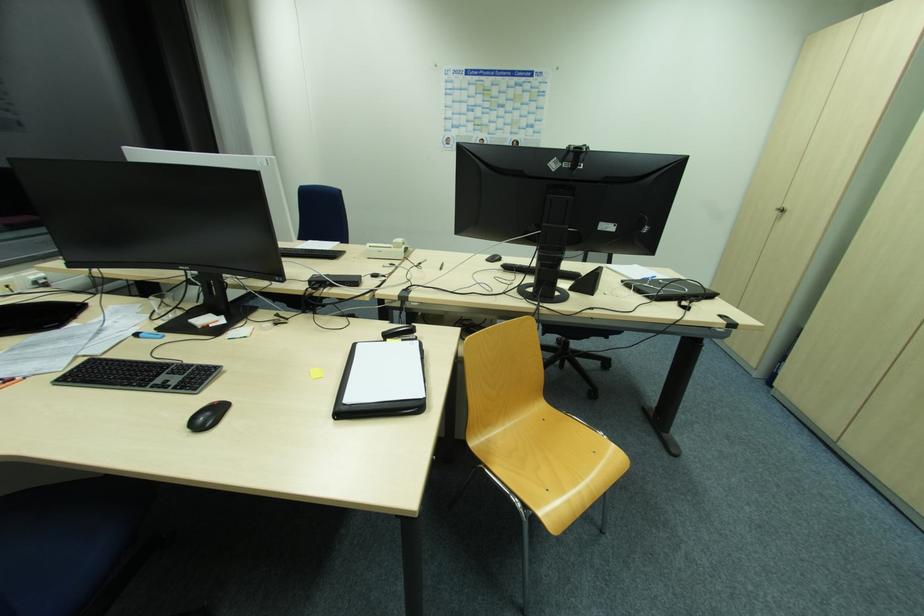
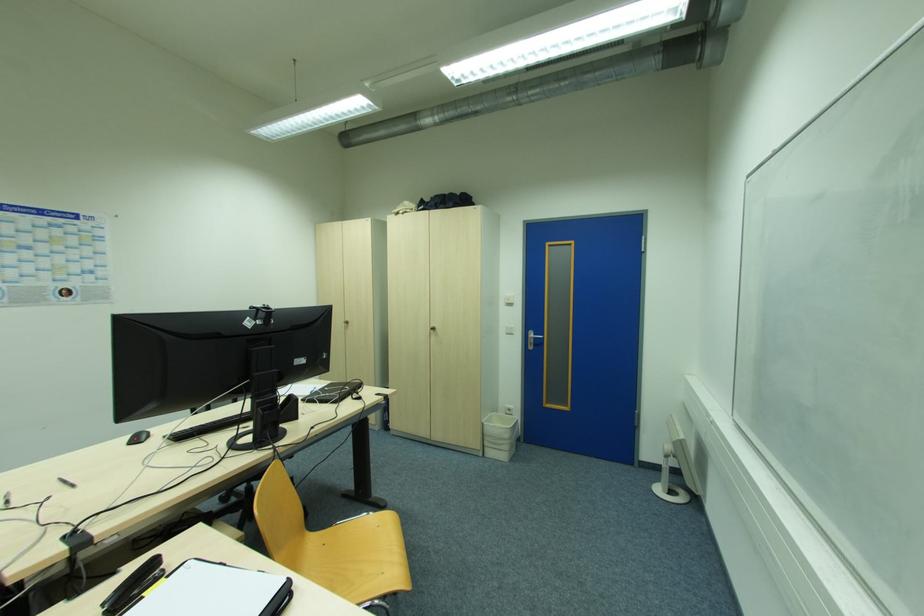
Question: The first image is from the beginning of the video and the second image is from the end. How did the camera likely rotate when shooting the video?

Choices:
 (A) Left
 (B) Right
 (C) Up
 (D) Down

Answer: (B)